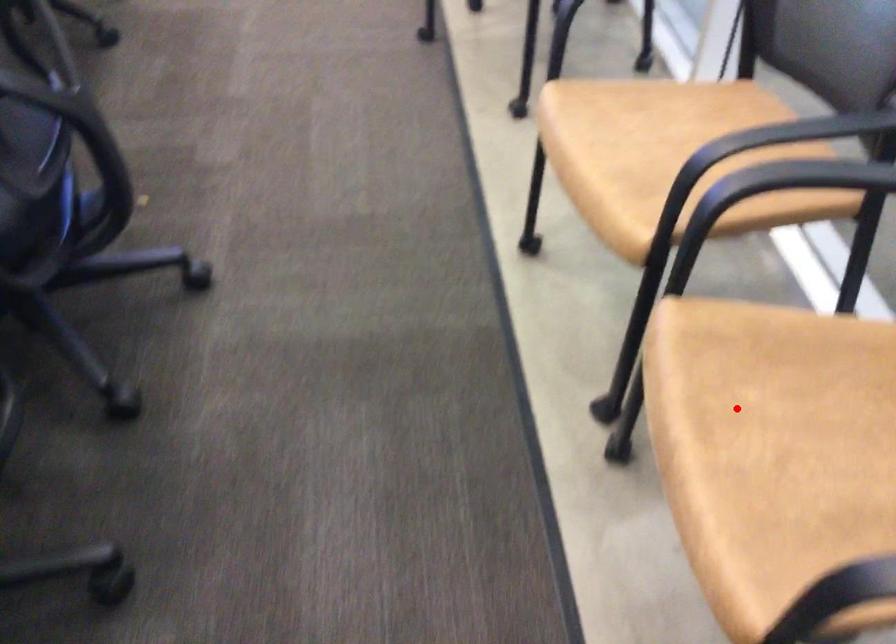
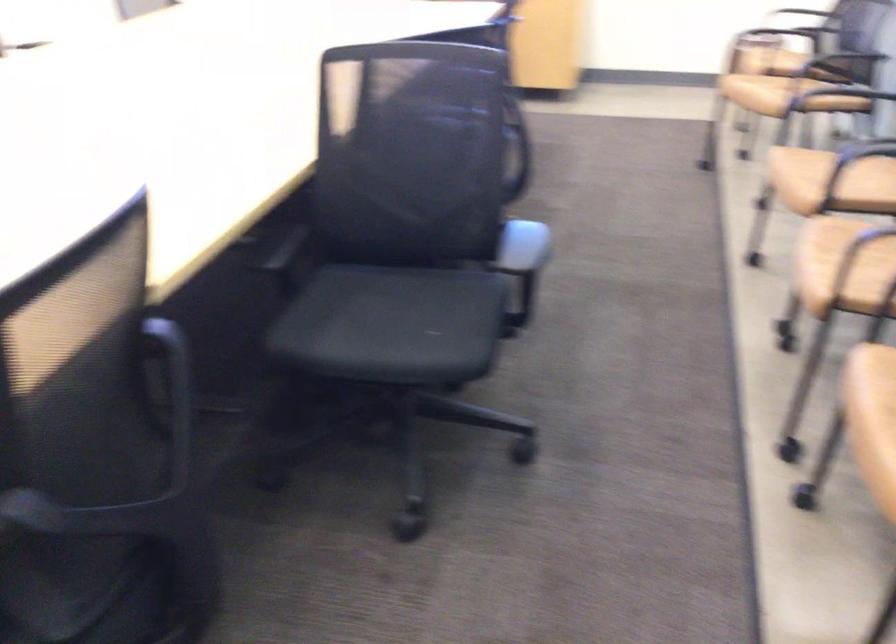
Question: I am providing you with two images of the same scene from different viewpoints. In image1, a red point is highlighted. Considering the same 3D point in image2, which of the following is correct?

Choices:
 (A) It is closer
 (B) It is farther

Answer: (B)